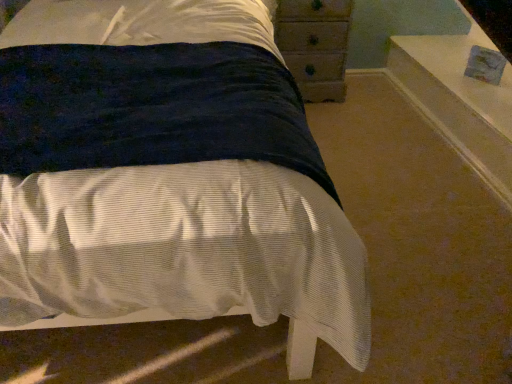
The height and width of the screenshot is (384, 512). Describe the element at coordinates (167, 172) in the screenshot. I see `velvet dark blue bed at center` at that location.

From the picture: What is the approximate height of white glossy window sill at upper right?

The height of white glossy window sill at upper right is 28.75 centimeters.

Where is `velvet dark blue bed at center`? The image size is (512, 384). velvet dark blue bed at center is located at coordinates (167, 172).

From a real-world perspective, is white glossy window sill at upper right beneath wooden chest of drawers at upper right?

Yes, from a real-world perspective, white glossy window sill at upper right is below wooden chest of drawers at upper right.

Considering the sizes of objects white glossy window sill at upper right and wooden chest of drawers at upper right in the image provided, who is taller, white glossy window sill at upper right or wooden chest of drawers at upper right?

wooden chest of drawers at upper right is taller.

Consider the image. Does white glossy window sill at upper right have a smaller size compared to wooden chest of drawers at upper right?

No.

Which of these two, white glossy window sill at upper right or wooden chest of drawers at upper right, is wider?

With larger width is white glossy window sill at upper right.

Is there a large distance between wooden chest of drawers at upper right and white glossy window sill at upper right?

Actually, wooden chest of drawers at upper right and white glossy window sill at upper right are a little close together.

From a real-world perspective, is wooden chest of drawers at upper right below white glossy window sill at upper right?

No, from a real-world perspective, wooden chest of drawers at upper right is not under white glossy window sill at upper right.

Which is more to the left, wooden chest of drawers at upper right or white glossy window sill at upper right?

wooden chest of drawers at upper right is more to the left.

Considering the sizes of objects wooden chest of drawers at upper right and white glossy window sill at upper right in the image provided, who is wider, wooden chest of drawers at upper right or white glossy window sill at upper right?

Wider between the two is white glossy window sill at upper right.

Where is `window sill lying above the velvet dark blue bed at center (from the image's perspective)`? This screenshot has width=512, height=384. window sill lying above the velvet dark blue bed at center (from the image's perspective) is located at coordinates (459, 101).

Could velvet dark blue bed at center be considered to be inside white glossy window sill at upper right?

No, white glossy window sill at upper right does not contain velvet dark blue bed at center.

From their relative heights in the image, would you say white glossy window sill at upper right is taller or shorter than velvet dark blue bed at center?

Considering their sizes, white glossy window sill at upper right has more height than velvet dark blue bed at center.

Consider the image. Which object is thinner, white glossy window sill at upper right or velvet dark blue bed at center?

With smaller width is white glossy window sill at upper right.

Considering the positions of points (278, 298) and (408, 96), is point (278, 298) closer to camera compared to point (408, 96)?

Yes, point (278, 298) is closer to viewer.

Considering their positions, is velvet dark blue bed at center located in front of or behind white glossy window sill at upper right?

Visually, velvet dark blue bed at center is located in front of white glossy window sill at upper right.

Can we say velvet dark blue bed at center lies outside white glossy window sill at upper right?

Absolutely, velvet dark blue bed at center is external to white glossy window sill at upper right.

Considering the sizes of objects velvet dark blue bed at center and white glossy window sill at upper right in the image provided, who is wider, velvet dark blue bed at center or white glossy window sill at upper right?

With larger width is velvet dark blue bed at center.

Considering the sizes of velvet dark blue bed at center and wooden chest of drawers at upper right in the image, is velvet dark blue bed at center taller or shorter than wooden chest of drawers at upper right?

Clearly, velvet dark blue bed at center is shorter compared to wooden chest of drawers at upper right.

Locate an element on the screen. The height and width of the screenshot is (384, 512). bed that is on the left side of wooden chest of drawers at upper right is located at coordinates (167, 172).

Considering the points (239, 219) and (303, 96), which point is in front, point (239, 219) or point (303, 96)?

The point (239, 219) is more forward.

From a real-world perspective, which object rests below the other?

velvet dark blue bed at center.

From the image's perspective, is wooden chest of drawers at upper right located above or below velvet dark blue bed at center?

Based on their image positions, wooden chest of drawers at upper right is located above velvet dark blue bed at center.

Which object is further away from the camera taking this photo, wooden chest of drawers at upper right or velvet dark blue bed at center?

wooden chest of drawers at upper right is more distant.

Is wooden chest of drawers at upper right positioned with its back to velvet dark blue bed at center?

wooden chest of drawers at upper right does not have its back to velvet dark blue bed at center.

From a real-world perspective, who is located lower, wooden chest of drawers at upper right or velvet dark blue bed at center?

In real-world perspective, velvet dark blue bed at center is lower.

Where is `chest of drawers on the left of white glossy window sill at upper right`? chest of drawers on the left of white glossy window sill at upper right is located at coordinates (315, 45).

You are a GUI agent. You are given a task and a screenshot of the screen. Output one action in this format:
    pyautogui.click(x=<x>, y=<y>)
    Task: Click on the window sill on the right of wooden chest of drawers at upper right
    This screenshot has width=512, height=384.
    Given the screenshot: What is the action you would take?
    pyautogui.click(x=459, y=101)

When comparing their distances from wooden chest of drawers at upper right, does velvet dark blue bed at center or white glossy window sill at upper right seem closer?

white glossy window sill at upper right lies closer to wooden chest of drawers at upper right than the other object.

Looking at the image, which one is located closer to white glossy window sill at upper right, velvet dark blue bed at center or wooden chest of drawers at upper right?

The object closer to white glossy window sill at upper right is wooden chest of drawers at upper right.

Which object lies nearer to the anchor point velvet dark blue bed at center, wooden chest of drawers at upper right or white glossy window sill at upper right?

wooden chest of drawers at upper right lies closer to velvet dark blue bed at center than the other object.

Looking at the image, which one is located closer to white glossy window sill at upper right, wooden chest of drawers at upper right or velvet dark blue bed at center?

Based on the image, wooden chest of drawers at upper right appears to be nearer to white glossy window sill at upper right.

When comparing their distances from velvet dark blue bed at center, does white glossy window sill at upper right or wooden chest of drawers at upper right seem closer?

wooden chest of drawers at upper right.

From the image, which object appears to be farther from wooden chest of drawers at upper right, white glossy window sill at upper right or velvet dark blue bed at center?

velvet dark blue bed at center.

Locate an element on the screen. the chest of drawers located between velvet dark blue bed at center and white glossy window sill at upper right in the left-right direction is located at coordinates (315, 45).